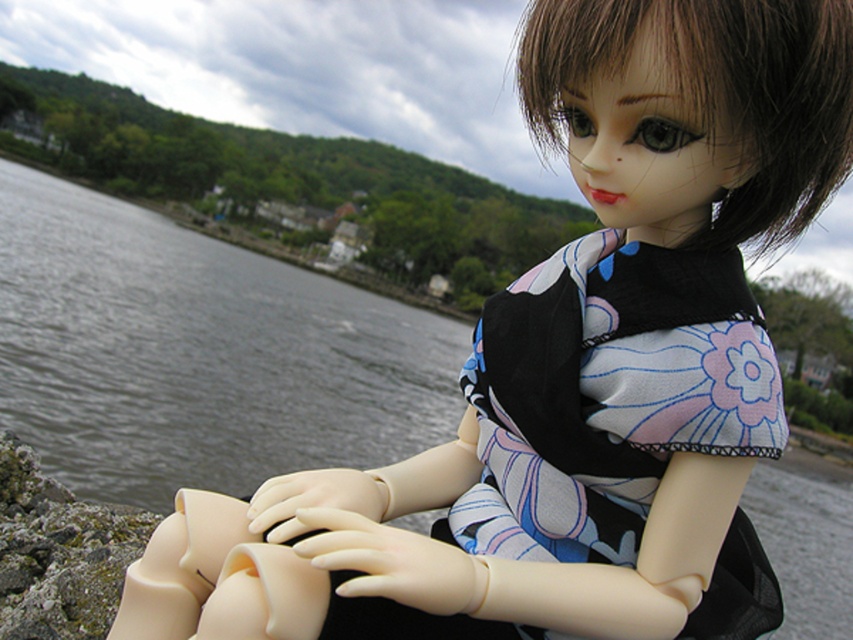
You are a photographer trying to capture the doll in the scene. You want to ensure the gray water at left and the silky floral dress at center are both visible in your shot. Based on their positions, which object should you adjust your camera focus on first to include both in the frame?

The gray water at left is to the left of the silky floral dress at center, so you should focus on the silky floral dress at center first to ensure both are in the frame.

You are a photographer trying to capture the doll in the scene. To ensure the gray water at left is visible in the shot, where should you position the camera relative to the doll?

The gray water at left is located at point 0.555 on the x axis and 0.233 on the y axis, so the camera should be positioned to the left side of the doll to include the gray water at left in the frame.